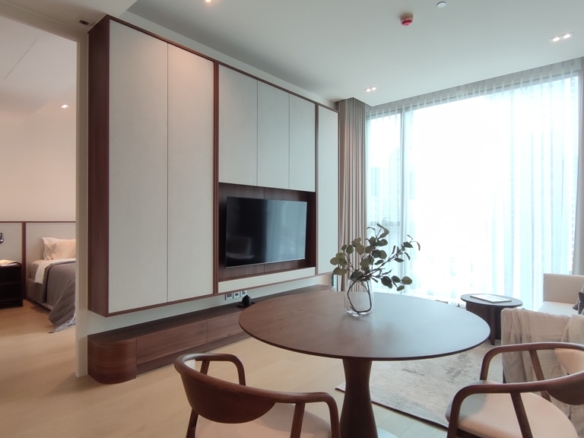
The width and height of the screenshot is (584, 438). I want to click on tv, so click(259, 232).